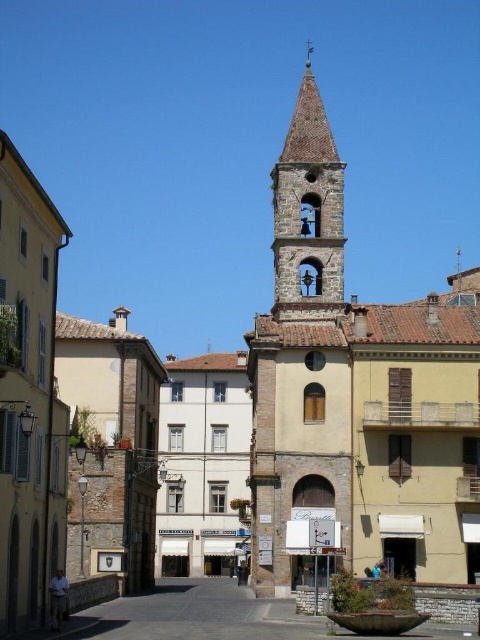
You are a delivery person trying to navigate through the town square. You need to pass between the light brown stone church at center and the smooth concrete alley at center. Can you fit through the space between them if your delivery cart is 2 meters wide?

The light brown stone church at center is thinner than the smooth concrete alley at center, so the space between them is wider than the church. Since your delivery cart is 2 meters wide, you need to check if the space is at least 2 meters wide. However, the exact width isn

You are standing in the European town square and want to find the light brown stone church at center. According to the coordinates given, where should you look relative to the square?

The light brown stone church at center is located at coordinates point (x=356, y=397), which means it is positioned towards the lower right side of the square.

You are standing in the European town square and want to take a photo of the light brown stone church at center and the smooth concrete alley at center. Which one should you point your camera upwards to capture?

You should point your camera upwards to capture the light brown stone church at center because it is located above the smooth concrete alley at center.